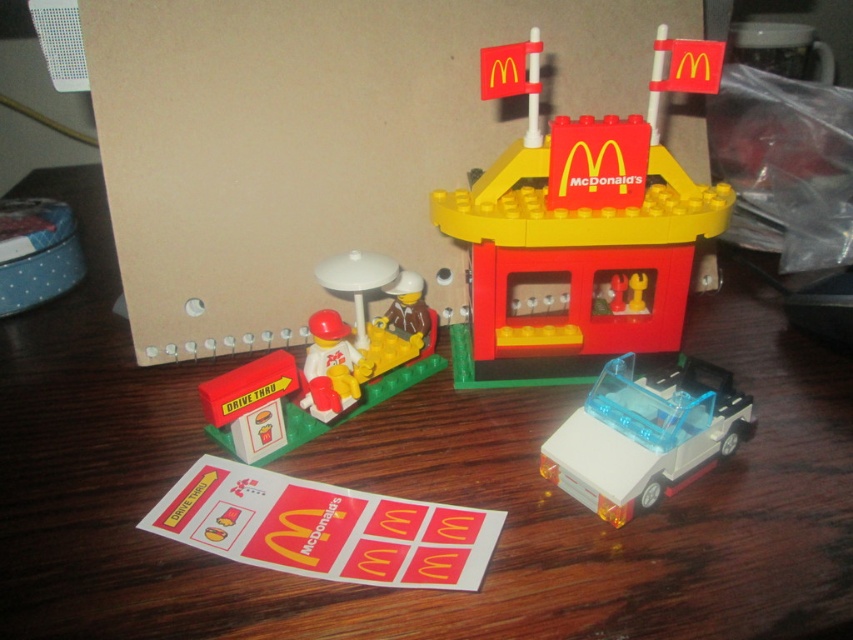
Is yellow matte umbrella at center further to the viewer compared to white translucent plastic car at lower right?

Yes, it is.

Which is in front, point (241, 368) or point (712, 400)?

Point (712, 400) is in front.

You are a GUI agent. You are given a task and a screenshot of the screen. Output one action in this format:
    pyautogui.click(x=<x>, y=<y>)
    Task: Click on the yellow matte umbrella at center
    The image size is (853, 640).
    Given the screenshot: What is the action you would take?
    pyautogui.click(x=323, y=365)

Based on the photo, who is higher up, yellow matte umbrella at center or white matte figure at center?

yellow matte umbrella at center is higher up.

Does yellow matte umbrella at center appear under white matte figure at center?

Actually, yellow matte umbrella at center is above white matte figure at center.

Does point (407, 344) lie in front of point (361, 365)?

No, (407, 344) is further to viewer.

Where is `yellow matte umbrella at center`? This screenshot has width=853, height=640. yellow matte umbrella at center is located at coordinates (323, 365).

Is white translucent plastic car at lower right smaller than white matte figure at center?

Incorrect, white translucent plastic car at lower right is not smaller in size than white matte figure at center.

Between white translucent plastic car at lower right and white matte figure at center, which one has less height?

white matte figure at center is shorter.

You are a GUI agent. You are given a task and a screenshot of the screen. Output one action in this format:
    pyautogui.click(x=<x>, y=<y>)
    Task: Click on the white translucent plastic car at lower right
    The height and width of the screenshot is (640, 853).
    Given the screenshot: What is the action you would take?
    pyautogui.click(x=645, y=435)

The width and height of the screenshot is (853, 640). In order to click on white translucent plastic car at lower right in this screenshot , I will do `click(645, 435)`.